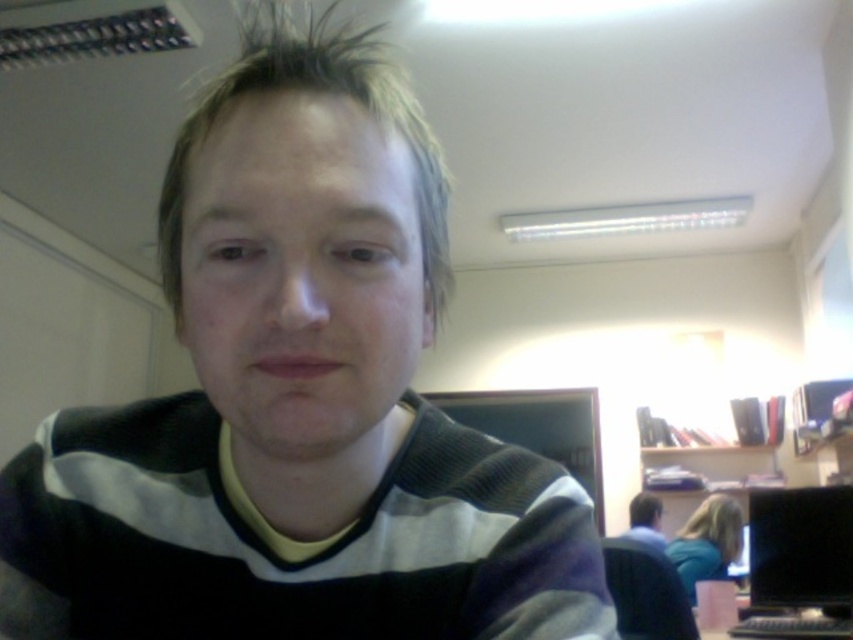
Question: Which of the following is the closest to the observer?

Choices:
 (A) black striped sweater at center
 (B) matte black sweater at center
 (C) black glossy monitor at right

Answer: (A)

Question: Is black glossy monitor at right in front of matte black sweater at center?

Choices:
 (A) no
 (B) yes

Answer: (B)

Question: From the image, what is the correct spatial relationship of black striped sweater at center in relation to black glossy monitor at right?

Choices:
 (A) below
 (B) above

Answer: (B)

Question: Which object appears closest to the camera in this image?

Choices:
 (A) matte black sweater at center
 (B) black striped sweater at center

Answer: (B)

Question: Which point is farther from the camera taking this photo?

Choices:
 (A) (325, 180)
 (B) (648, 532)
 (C) (819, 499)

Answer: (B)

Question: Can you confirm if black striped sweater at center is positioned to the right of matte black sweater at center?

Choices:
 (A) no
 (B) yes

Answer: (A)